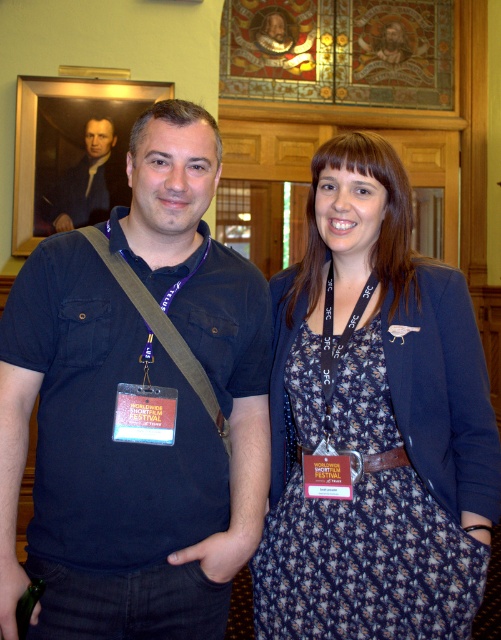
Is smooth white face at upper left taller than white fabric lanyard at center?

Correct, smooth white face at upper left is much taller as white fabric lanyard at center.

Image resolution: width=501 pixels, height=640 pixels. In order to click on smooth white face at upper left in this screenshot , I will do `click(86, 180)`.

Where is `smooth white face at upper left`? smooth white face at upper left is located at coordinates (86, 180).

Image resolution: width=501 pixels, height=640 pixels. I want to click on plastic badge at center, so click(144, 413).

Is plastic badge at center above white fabric lanyard at center?

Actually, plastic badge at center is below white fabric lanyard at center.

Where is `plastic badge at center`? Image resolution: width=501 pixels, height=640 pixels. plastic badge at center is located at coordinates (144, 413).

What do you see at coordinates (144, 413) in the screenshot? I see `plastic badge at center` at bounding box center [144, 413].

Who is higher up, plastic badge at center or orange card at center?

plastic badge at center is higher up.

Locate an element on the screen. The width and height of the screenshot is (501, 640). plastic badge at center is located at coordinates (144, 413).